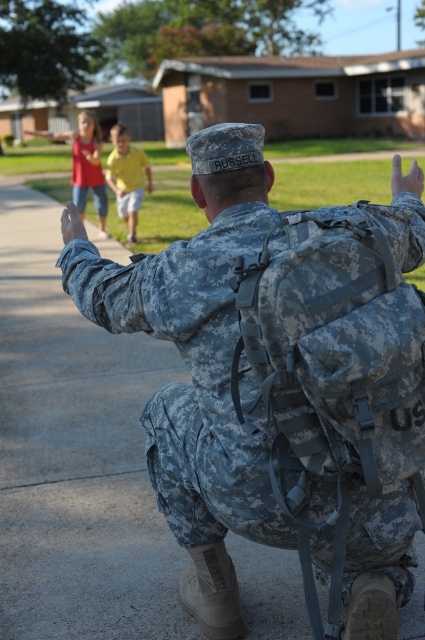
Question: Which is nearer to the yellow matte shirt at center?

Choices:
 (A) camouflage fabric uniform at center
 (B) matte camouflage uniform at upper left

Answer: (B)

Question: Which point is closer to the camera taking this photo?

Choices:
 (A) (232, 426)
 (B) (121, 156)

Answer: (A)

Question: Is yellow matte shirt at center smaller than matte camouflage uniform at upper left?

Choices:
 (A) no
 (B) yes

Answer: (A)

Question: Does camouflage fabric uniform at center appear under matte camouflage uniform at upper left?

Choices:
 (A) no
 (B) yes

Answer: (B)

Question: Which point is farther to the camera?

Choices:
 (A) yellow matte shirt at center
 (B) matte camouflage uniform at upper left

Answer: (B)

Question: Does yellow matte shirt at center appear on the left side of matte camouflage uniform at upper left?

Choices:
 (A) yes
 (B) no

Answer: (B)